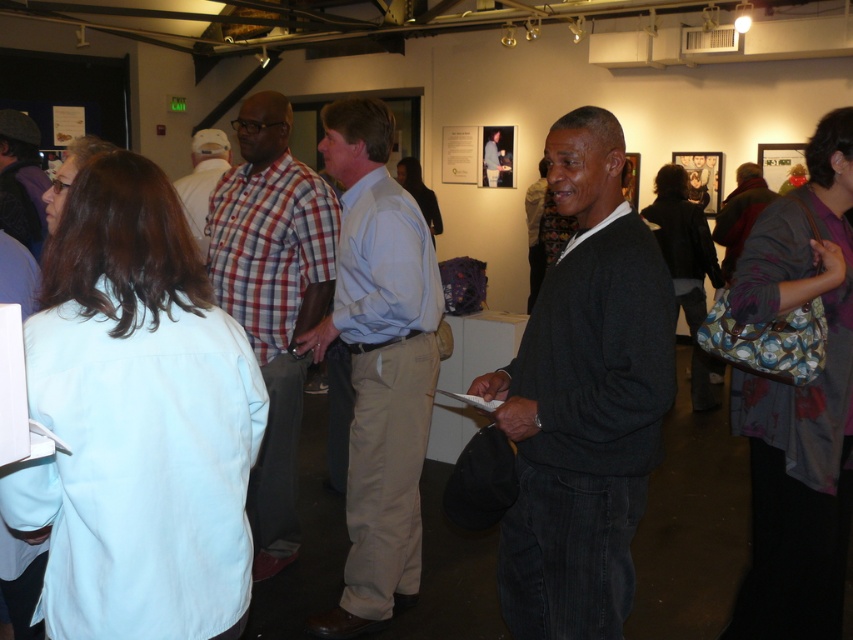
You are standing at the point with coordinates point (378, 364). Which person are you closest to?

You are closest to the light blue shirt at center, as the point (378, 364) corresponds to that location.